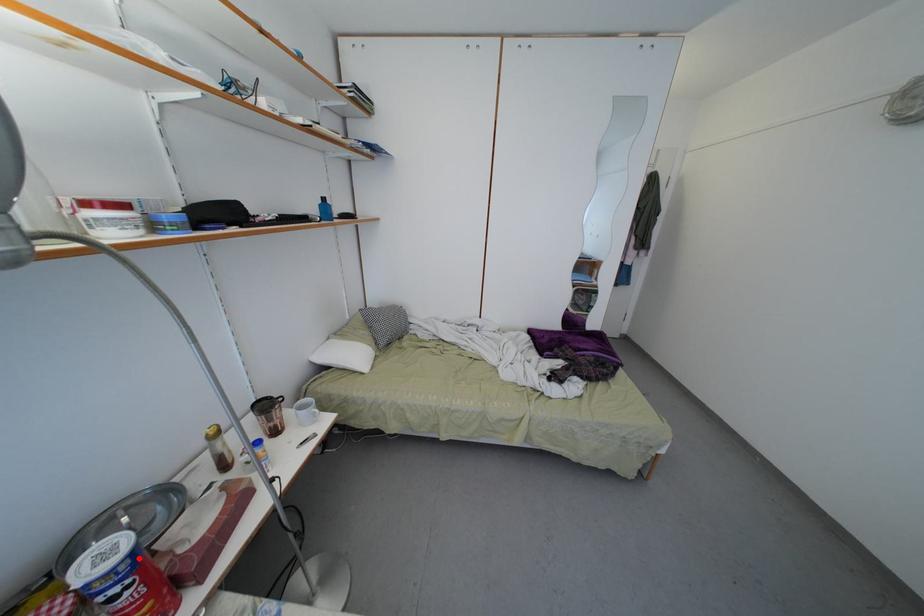
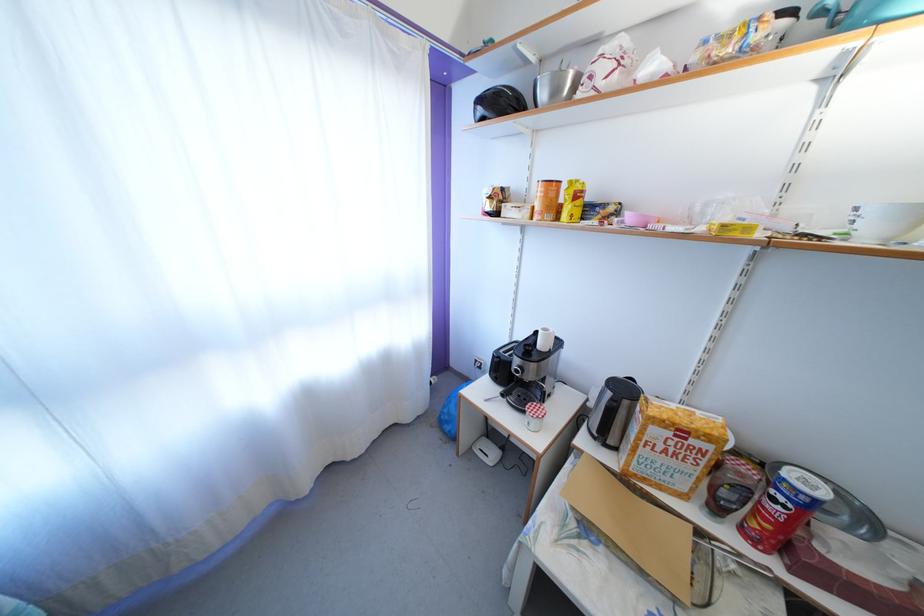
Locate, in the second image, the point that corresponds to the highlighted location in the first image.

(821, 508)